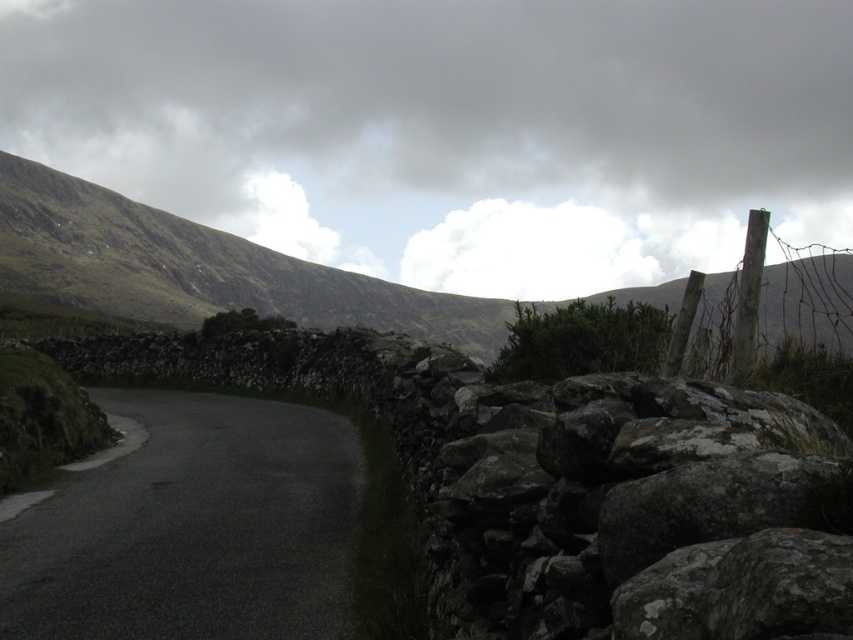
Question: Estimate the real-world distances between objects in this image. Which object is farther from the white fluffy cloud at upper center?

Choices:
 (A) gray rough stone at right
 (B) dark asphalt road at lower left

Answer: (B)

Question: Considering the relative positions of white fluffy cloud at upper center and dark asphalt road at lower left in the image provided, where is white fluffy cloud at upper center located with respect to dark asphalt road at lower left?

Choices:
 (A) left
 (B) right

Answer: (B)

Question: Does gray rough stone at right come in front of dark asphalt road at lower left?

Choices:
 (A) no
 (B) yes

Answer: (B)

Question: Does white fluffy cloud at upper center appear on the left side of dark asphalt road at lower left?

Choices:
 (A) yes
 (B) no

Answer: (B)

Question: Which object appears farthest from the camera in this image?

Choices:
 (A) white fluffy cloud at upper center
 (B) gray rough stone at right

Answer: (A)

Question: Among these points, which one is nearest to the camera?

Choices:
 (A) (126, 29)
 (B) (705, 454)

Answer: (B)